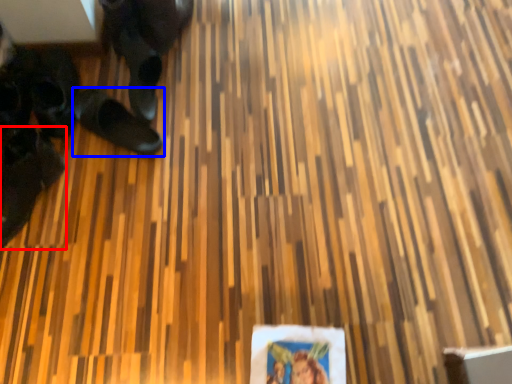
Question: Which object appears farthest to the camera in this image, footwear (highlighted by a red box) or footwear (highlighted by a blue box)?

Choices:
 (A) footwear
 (B) footwear

Answer: (B)